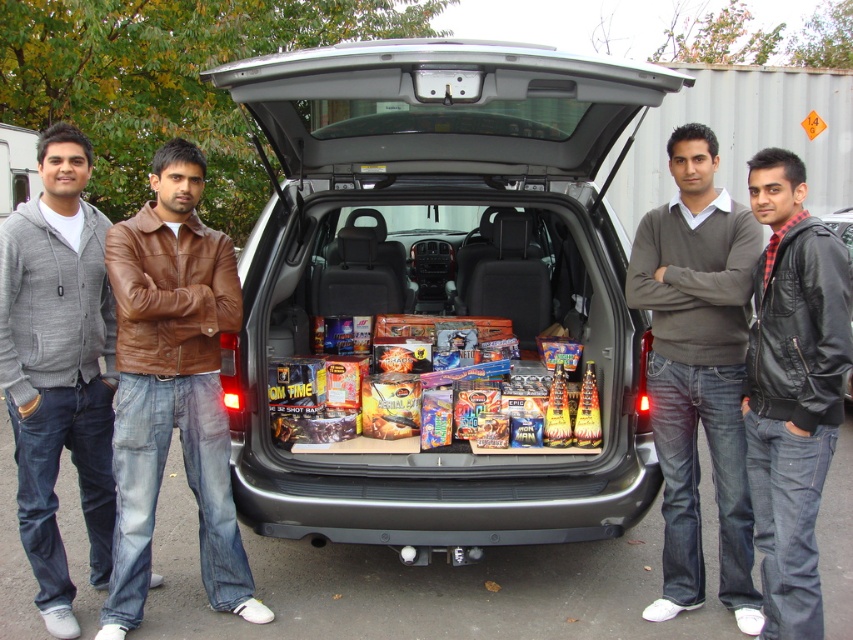
Question: Where is dark gray sweater at center located in relation to multicolored cardboard fireworks at center in the image?

Choices:
 (A) right
 (B) left

Answer: (A)

Question: Is the position of satin black car at center more distant than that of denim jeans at left?

Choices:
 (A) no
 (B) yes

Answer: (A)

Question: Is black leather jacket at center positioned behind multicolored cardboard fireworks at center?

Choices:
 (A) yes
 (B) no

Answer: (B)

Question: Among these points, which one is nearest to the camera?

Choices:
 (A) (132, 330)
 (B) (460, 316)
 (C) (741, 524)
 (D) (560, 536)

Answer: (A)

Question: Which point appears farthest from the camera in this image?

Choices:
 (A) click(x=762, y=273)
 (B) click(x=238, y=556)
 (C) click(x=445, y=342)

Answer: (C)

Question: Which point appears closest to the camera in this image?

Choices:
 (A) (691, 388)
 (B) (181, 392)
 (C) (473, 445)
 (D) (781, 374)

Answer: (D)